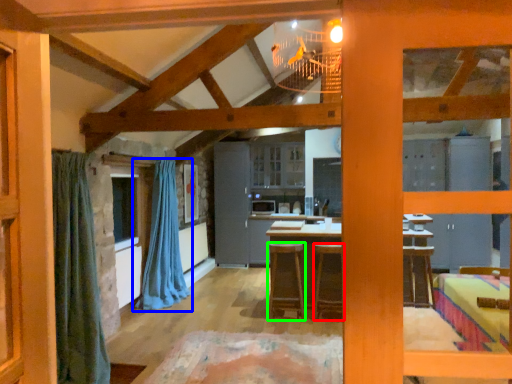
Question: Which is nearer to the stool (highlighted by a red box)? curtain (highlighted by a blue box) or stool (highlighted by a green box).

Choices:
 (A) curtain
 (B) stool

Answer: (B)